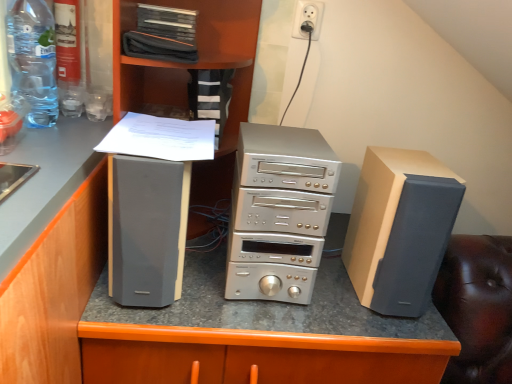
The height and width of the screenshot is (384, 512). Identify the location of free location in front of silver metallic stereo stack at center. (255, 322).